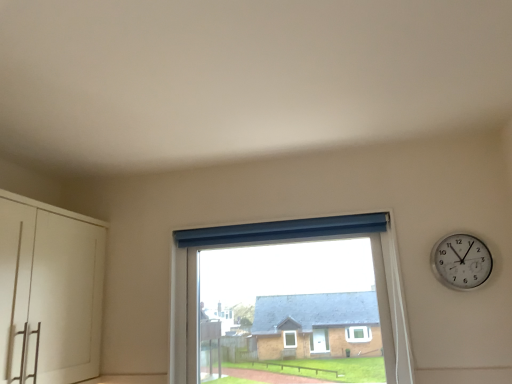
Question: Looking at their shapes, would you say silver metallic wall clock at upper right is wider or thinner than transparent glass window at center?

Choices:
 (A) wide
 (B) thin

Answer: (B)

Question: From a real-world perspective, is silver metallic wall clock at upper right positioned above or below transparent glass window at center?

Choices:
 (A) below
 (B) above

Answer: (B)

Question: Which object is the farthest from the silver metallic wall clock at upper right?

Choices:
 (A) transparent glass window at center
 (B) white matte cabinet at left

Answer: (B)

Question: Based on their relative distances, which object is farther from the transparent glass window at center?

Choices:
 (A) silver metallic wall clock at upper right
 (B) white matte cabinet at left

Answer: (B)